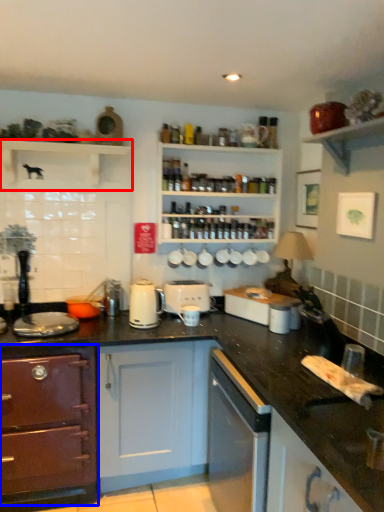
Question: Which point is closer to the camera, shelf (highlighted by a red box) or cabinetry (highlighted by a blue box)?

Choices:
 (A) shelf
 (B) cabinetry

Answer: (B)